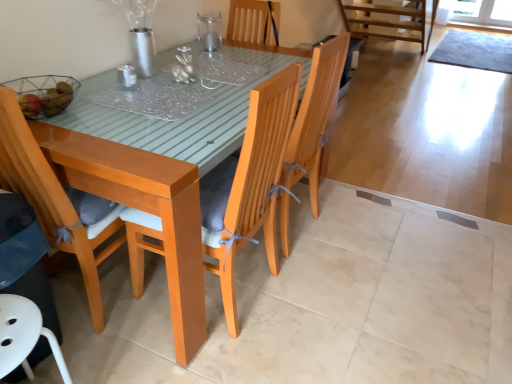
Question: Can you confirm if white plastic chair at lower left, placed as the first chair when sorted from left to right, is wider than metallic silver candlestick at center, the second tableware when ordered from top to bottom?

Choices:
 (A) yes
 (B) no

Answer: (A)

Question: Is white plastic chair at lower left, placed as the first chair when sorted from left to right, thinner than metallic silver candlestick at center, which is the 1th tableware in front-to-back order?

Choices:
 (A) yes
 (B) no

Answer: (B)

Question: Can you confirm if white plastic chair at lower left, placed as the first chair when sorted from left to right, is smaller than metallic silver candlestick at center, placed as the second tableware when sorted from back to front?

Choices:
 (A) yes
 (B) no

Answer: (B)

Question: Is white plastic chair at lower left, which ranks as the third chair in right-to-left order, completely or partially outside of metallic silver candlestick at center, positioned as the second tableware in right-to-left order?

Choices:
 (A) yes
 (B) no

Answer: (A)

Question: Does white plastic chair at lower left, which ranks as the third chair in right-to-left order, have a lesser height compared to metallic silver candlestick at center, which is counted as the 1th tableware, starting from the bottom?

Choices:
 (A) yes
 (B) no

Answer: (B)

Question: Can metallic silver candlestick at center, placed as the second tableware when sorted from back to front, be found inside white plastic chair at lower left, which ranks as the third chair in right-to-left order?

Choices:
 (A) yes
 (B) no

Answer: (B)

Question: From a real-world perspective, is wooden swivel chair at lower left over matte wood chair at left, positioned as the 2th chair in right-to-left order?

Choices:
 (A) no
 (B) yes

Answer: (A)

Question: Does wooden swivel chair at lower left appear on the left side of matte wood chair at left, positioned as the 2th chair in right-to-left order?

Choices:
 (A) yes
 (B) no

Answer: (A)

Question: Considering the relative sizes of wooden swivel chair at lower left and matte wood chair at left, placed as the 2th chair when sorted from left to right, in the image provided, is wooden swivel chair at lower left bigger than matte wood chair at left, placed as the 2th chair when sorted from left to right,?

Choices:
 (A) yes
 (B) no

Answer: (B)

Question: Is wooden swivel chair at lower left aimed at matte wood chair at left, placed as the 2th chair when sorted from left to right?

Choices:
 (A) yes
 (B) no

Answer: (B)

Question: Is wooden swivel chair at lower left shorter than matte wood chair at left, placed as the 2th chair when sorted from left to right?

Choices:
 (A) no
 (B) yes

Answer: (B)

Question: From the image's perspective, is wooden swivel chair at lower left under matte wood chair at left, positioned as the 2th chair in right-to-left order?

Choices:
 (A) yes
 (B) no

Answer: (A)

Question: Is white plastic chair at lower left, which ranks as the third chair in right-to-left order, completely or partially inside matte wood chair at left, positioned as the 2th chair in right-to-left order?

Choices:
 (A) no
 (B) yes

Answer: (A)